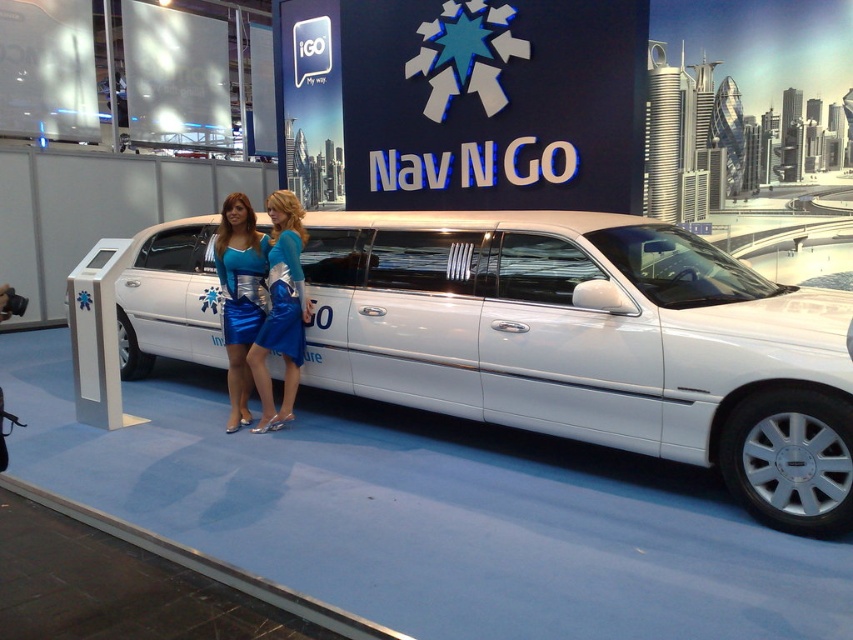
In the scene shown: You are a photographer at the trade show and need to capture both the blue satin dress at center and the shiny blue dress at center in a single photo. Which dress should you position closer to the camera to ensure both are fully visible?

The blue satin dress at center is smaller than the shiny blue dress at center, so you should position the blue satin dress at center closer to the camera to ensure both are fully visible.

You are standing at the exhibition and want to take a photo of the white metallic sedan at center. If your camera has a maximum focus range of 3 meters, will you be able to capture a clear photo?

The white metallic sedan at center is 3.22 meters away from the viewer. Since the camera can only focus up to 3 meters, the distance is beyond the camera s maximum range. Therefore, the photo may not be clear unless you move closer.

You are at a trade show and want to locate the white metallic sedan at center. According to the coordinates provided, where should you look on the display?

The white metallic sedan at center is located at point coordinates 0.537 on the x axis and 0.696 on the y axis.